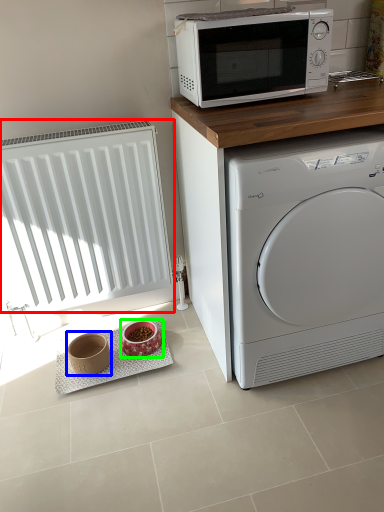
Question: Which object is positioned farthest from radiator (highlighted by a red box)? Select from appliance (highlighted by a blue box) and appliance (highlighted by a green box).

Choices:
 (A) appliance
 (B) appliance

Answer: (B)